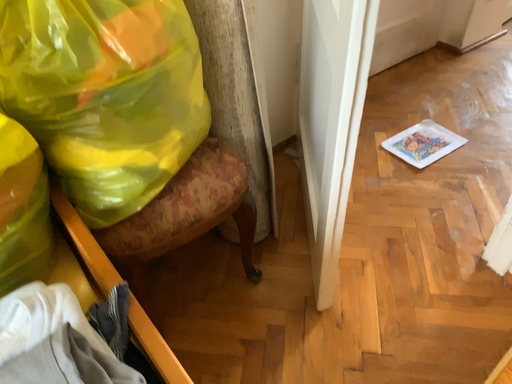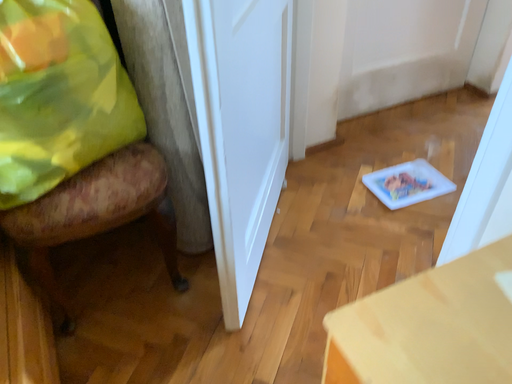
Question: Which way did the camera rotate in the video?

Choices:
 (A) rotated left
 (B) rotated right

Answer: (A)